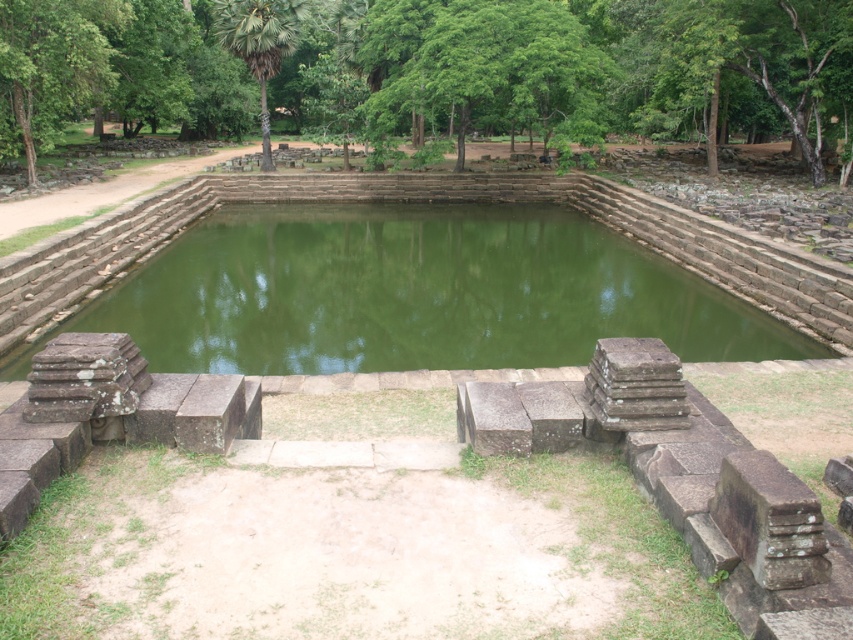
You are a botanist studying tree sizes in the area. You observe the green leafy tree at center and the green leafy tree at upper left. Which tree has a wider spread of branches?

The green leafy tree at center has a wider spread of branches than the green leafy tree at upper left.

Looking at this image, you are standing at the edge of the green stone lake at center and want to take a photo of the green leafy palm tree at upper center. In which direction should you point your camera to capture the tree in the frame?

To capture the green leafy palm tree at upper center in your photo, you should point your camera to the left, as the green stone lake at center is positioned to the right of the green leafy palm tree at upper center.